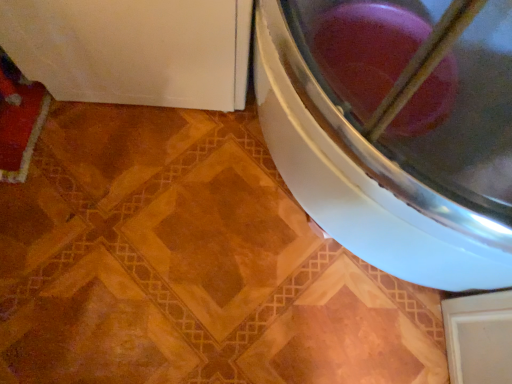
The height and width of the screenshot is (384, 512). I want to click on white glossy washing machine at lower right, so click(397, 155).

What do you see at coordinates (397, 155) in the screenshot? The width and height of the screenshot is (512, 384). I see `white glossy washing machine at lower right` at bounding box center [397, 155].

Where is `white glossy washing machine at lower left`? Image resolution: width=512 pixels, height=384 pixels. white glossy washing machine at lower left is located at coordinates (133, 50).

Describe the element at coordinates (133, 50) in the screenshot. I see `white glossy washing machine at lower left` at that location.

The width and height of the screenshot is (512, 384). I want to click on white glossy washing machine at lower right, so (397, 155).

Considering the relative positions of white glossy washing machine at lower right and white glossy washing machine at lower left in the image provided, is white glossy washing machine at lower right to the right of white glossy washing machine at lower left from the viewer's perspective?

Correct, you'll find white glossy washing machine at lower right to the right of white glossy washing machine at lower left.

Which object is further away from the camera, white glossy washing machine at lower right or white glossy washing machine at lower left?

white glossy washing machine at lower left is more distant.

Is point (314, 209) closer to camera compared to point (227, 46)?

No, (314, 209) is behind (227, 46).

From the image's perspective, is white glossy washing machine at lower right located above white glossy washing machine at lower left?

Incorrect, from the image's perspective, white glossy washing machine at lower right is lower than white glossy washing machine at lower left.

From a real-world perspective, does white glossy washing machine at lower right sit lower than white glossy washing machine at lower left?

No, from a real-world perspective, white glossy washing machine at lower right is not below white glossy washing machine at lower left.

Does white glossy washing machine at lower right have a greater width compared to white glossy washing machine at lower left?

Yes, white glossy washing machine at lower right is wider than white glossy washing machine at lower left.

Considering the sizes of objects white glossy washing machine at lower right and white glossy washing machine at lower left in the image provided, who is shorter, white glossy washing machine at lower right or white glossy washing machine at lower left?

white glossy washing machine at lower left is shorter.

Between white glossy washing machine at lower right and white glossy washing machine at lower left, which one has smaller size?

white glossy washing machine at lower left is smaller.

Looking at this image, does white glossy washing machine at lower right contain white glossy washing machine at lower left?

No, white glossy washing machine at lower left is not inside white glossy washing machine at lower right.

Is there a large distance between white glossy washing machine at lower right and white glossy washing machine at lower left?

white glossy washing machine at lower right is actually quite close to white glossy washing machine at lower left.

Is white glossy washing machine at lower right looking in the opposite direction of white glossy washing machine at lower left?

No, white glossy washing machine at lower right's orientation is not away from white glossy washing machine at lower left.

In the scene shown: How many degrees apart are the facing directions of white glossy washing machine at lower right and white glossy washing machine at lower left?

6.19 degrees separate the facing orientations of white glossy washing machine at lower right and white glossy washing machine at lower left.

Find the location of a particular element. Image resolution: width=512 pixels, height=384 pixels. appliance on the left of white glossy washing machine at lower right is located at coordinates (133, 50).

Is white glossy washing machine at lower left to the left or to the right of white glossy washing machine at lower right in the image?

Based on their positions, white glossy washing machine at lower left is located to the left of white glossy washing machine at lower right.

Relative to white glossy washing machine at lower right, is white glossy washing machine at lower left in front or behind?

white glossy washing machine at lower left is behind white glossy washing machine at lower right.

Is point (74, 60) farther from viewer compared to point (467, 38)?

Yes, point (74, 60) is farther from viewer.

From the image's perspective, between white glossy washing machine at lower left and white glossy washing machine at lower right, who is located below?

white glossy washing machine at lower right, from the image's perspective.

From a real-world perspective, which object rests below the other?

white glossy washing machine at lower left is physically lower.

Between white glossy washing machine at lower left and white glossy washing machine at lower right, which one has larger width?

Wider between the two is white glossy washing machine at lower right.

Between white glossy washing machine at lower left and white glossy washing machine at lower right, which one has less height?

white glossy washing machine at lower left is shorter.

Between white glossy washing machine at lower left and white glossy washing machine at lower right, which one has larger size?

white glossy washing machine at lower right is bigger.

Would you say white glossy washing machine at lower left contains white glossy washing machine at lower right?

No.

Is white glossy washing machine at lower left not close to white glossy washing machine at lower right?

No.

Is white glossy washing machine at lower left turned away from white glossy washing machine at lower right?

No, white glossy washing machine at lower left's orientation is not away from white glossy washing machine at lower right.

What's the angular difference between white glossy washing machine at lower left and white glossy washing machine at lower right's facing directions?

The angular difference between white glossy washing machine at lower left and white glossy washing machine at lower right is 6.19 degrees.

Identify the location of appliance that is on the left side of white glossy washing machine at lower right. The height and width of the screenshot is (384, 512). (133, 50).

In the image, there is a white glossy washing machine at lower right. At what (x,y) coordinates should I click in order to perform the action: click on appliance below it (from a real-world perspective). Please return your answer as a coordinate pair (x, y). The width and height of the screenshot is (512, 384). Looking at the image, I should click on (133, 50).

Image resolution: width=512 pixels, height=384 pixels. Find the location of `appliance on the left of white glossy washing machine at lower right`. appliance on the left of white glossy washing machine at lower right is located at coordinates (133, 50).